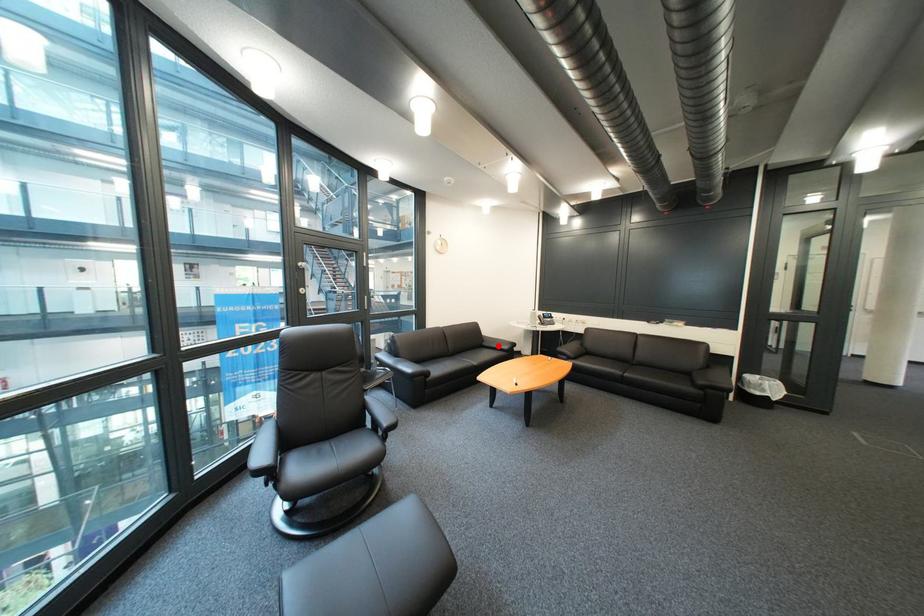
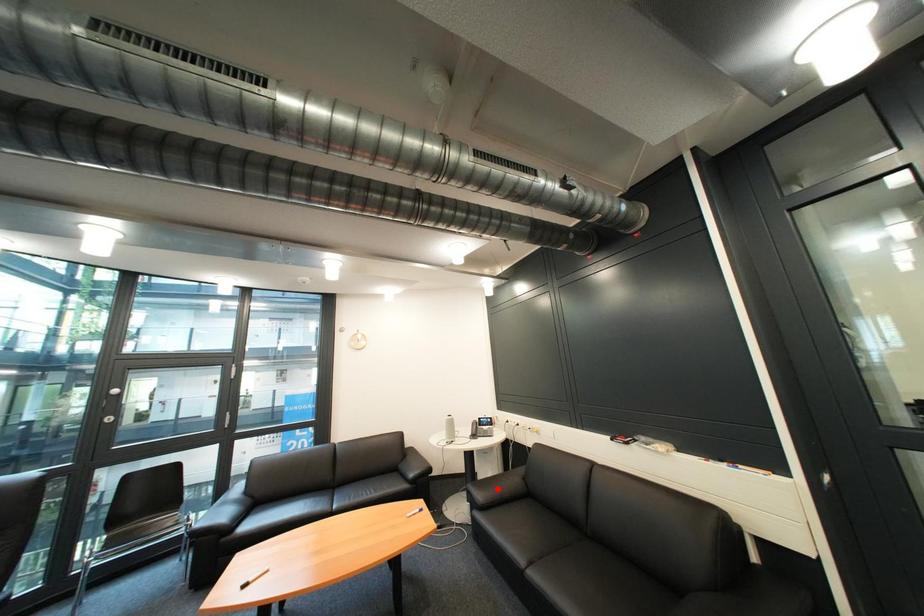
I am providing you with two images of the same scene from different viewpoints. A red point is marked on the first image and another point is marked on the second image. Do the highlighted points in image1 and image2 indicate the same real-world spot?

No